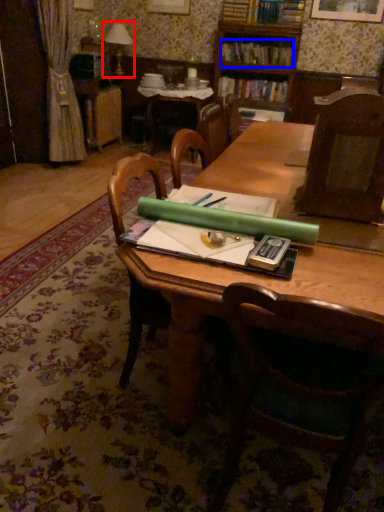
Question: Which object is closer to the camera taking this photo, table lamp (highlighted by a red box) or book (highlighted by a blue box)?

Choices:
 (A) table lamp
 (B) book

Answer: (B)